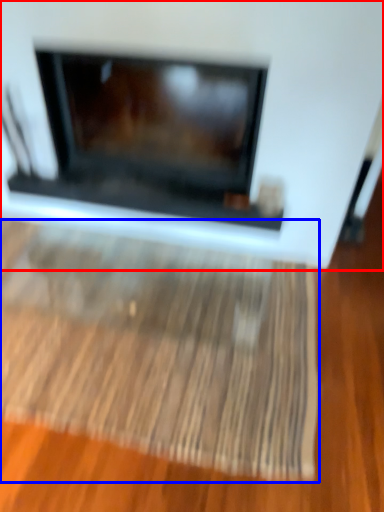
Question: Which object appears closest to the camera in this image, fireplace (highlighted by a red box) or mat (highlighted by a blue box)?

Choices:
 (A) fireplace
 (B) mat

Answer: (A)